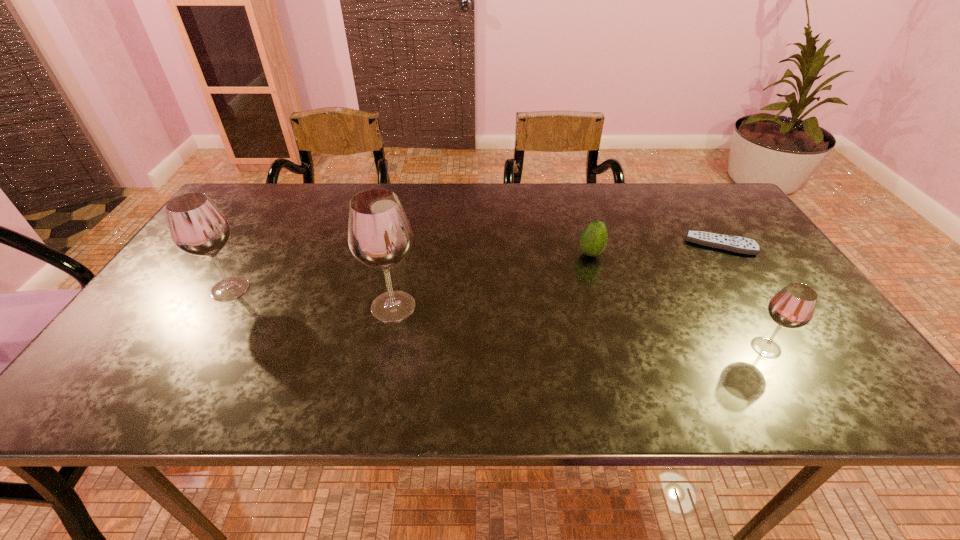
This screenshot has width=960, height=540. I want to click on the fourth shortest object, so click(x=197, y=227).

Locate an element on the screen. the leftmost wineglass is located at coordinates (197, 227).

Where is `the second object from left to right`? the second object from left to right is located at coordinates (379, 235).

The height and width of the screenshot is (540, 960). In order to click on the nearest object in this screenshot , I will do `click(793, 306)`.

This screenshot has height=540, width=960. In order to click on the shortest wineglass in this screenshot , I will do `click(793, 306)`.

Where is `the fourth tallest object`? The width and height of the screenshot is (960, 540). the fourth tallest object is located at coordinates (593, 240).

At what (x,y) coordinates should I click in order to perform the action: click on avocado. Please return your answer as a coordinate pair (x, y). Looking at the image, I should click on (593, 240).

This screenshot has height=540, width=960. Identify the location of the shortest object. (736, 244).

Locate an element on the screen. free space located on the right of the fourth shortest object is located at coordinates pos(376,289).

Identify the location of vacant space located on the left of the fourth object from right to left. The height and width of the screenshot is (540, 960). (274, 307).